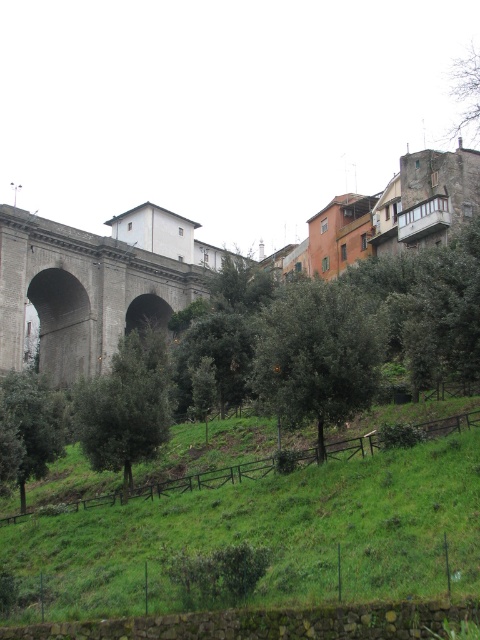
Is gray stone bridge at upper left thinner than green leafy tree at center?

In fact, gray stone bridge at upper left might be wider than green leafy tree at center.

Does gray stone bridge at upper left appear on the right side of green leafy tree at center?

No, gray stone bridge at upper left is not to the right of green leafy tree at center.

Is point (147, 300) positioned behind point (349, 349)?

Yes, point (147, 300) is farther from viewer.

This screenshot has width=480, height=640. I want to click on gray stone bridge at upper left, so click(82, 292).

Can you confirm if green leafy tree at center is bigger than green leafy tree at lower left?

Yes, green leafy tree at center is bigger than green leafy tree at lower left.

Who is taller, green leafy tree at center or green leafy tree at lower left?

green leafy tree at center

Is point (323, 292) farther from camera compared to point (4, 432)?

No, it is not.

Where is `green leafy tree at center`? This screenshot has width=480, height=640. green leafy tree at center is located at coordinates (316, 355).

In the scene shown: Measure the distance between green grassy hillside at lower center and camera.

green grassy hillside at lower center and camera are 30.17 meters apart.

The image size is (480, 640). What do you see at coordinates (266, 536) in the screenshot?
I see `green grassy hillside at lower center` at bounding box center [266, 536].

Is point (188, 604) positioned behind point (13, 449)?

No, (188, 604) is in front of (13, 449).

Find the location of `green grassy hillside at lower center`. green grassy hillside at lower center is located at coordinates (266, 536).